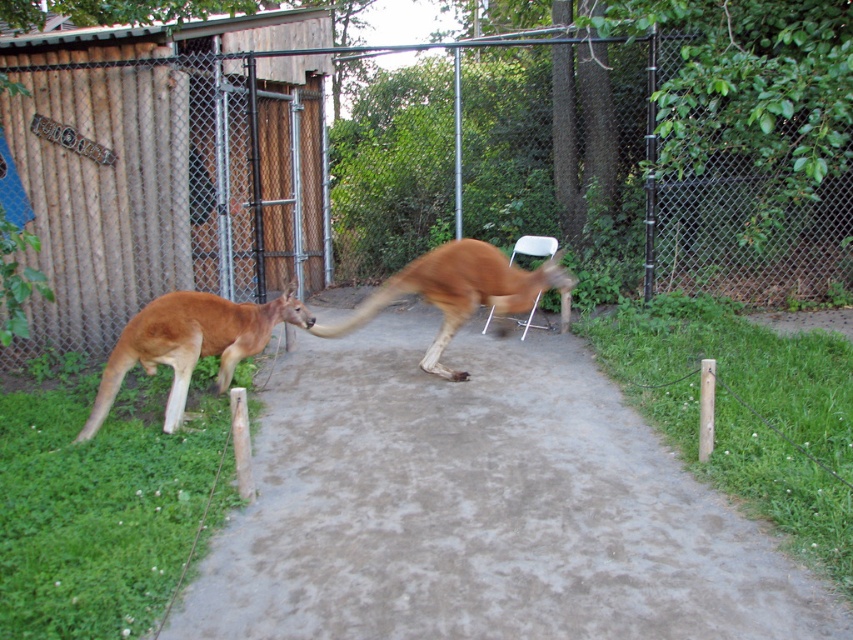
You are a zookeeper who needs to walk from one end of the enclosure to the other. There is a brown concrete pavement at center and a brown furry kangaroo at center in your path. Which path should you take to avoid stepping on the kangaroo?

You should take the brown concrete pavement at center because its width is larger than the brown furry kangaroo at center, providing enough space to walk around without stepping on the kangaroo.

You are a zookeeper standing on the paved pathway observing the two brown furry kangaroos. Which kangaroo is nearer to you, the brown furry kangaroo at left or the brown furry kangaroo at center?

The brown furry kangaroo at left is closer to the viewer than the brown furry kangaroo at center, so the kangaroo at left is nearer to you.